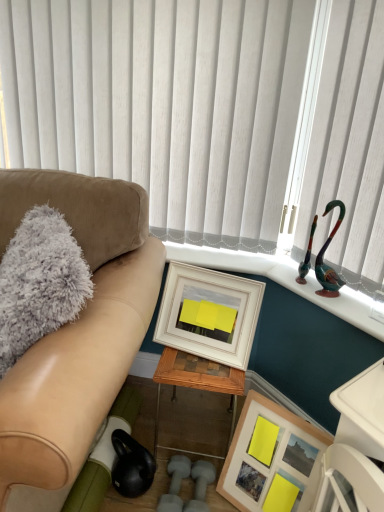
The height and width of the screenshot is (512, 384). What are the coordinates of `space that is in front of shiny green glass swan at upper right` in the screenshot? It's located at (348, 307).